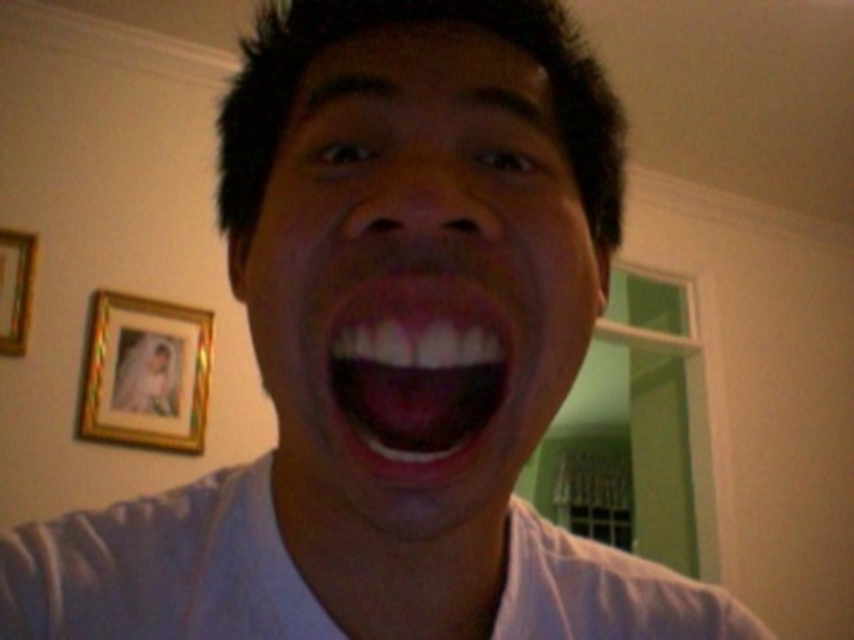
Question: Which point appears farthest from the camera in this image?

Choices:
 (A) (489, 433)
 (B) (139, 337)

Answer: (B)

Question: Which point is closer to the camera taking this photo?

Choices:
 (A) (10, 305)
 (B) (416, 332)
 (C) (475, 532)
 (D) (241, 492)

Answer: (B)

Question: Which point is closer to the camera taking this photo?

Choices:
 (A) (208, 566)
 (B) (344, 344)
 (C) (34, 240)

Answer: (B)

Question: Can you confirm if pink glossy lips at center is positioned above gold-framed picture at upper left?

Choices:
 (A) yes
 (B) no

Answer: (A)

Question: Does matte white face at center appear on the right side of gold wooden picture frame at left?

Choices:
 (A) yes
 (B) no

Answer: (A)

Question: Can you confirm if pink glossy lips at center is thinner than gold-framed picture at upper left?

Choices:
 (A) yes
 (B) no

Answer: (A)